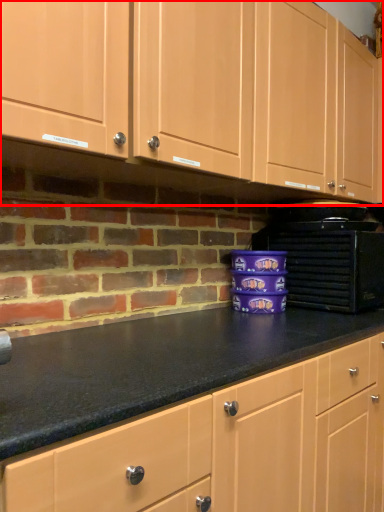
Question: In this image, where is cabinetry (annotated by the red box) located relative to home appliance?

Choices:
 (A) right
 (B) left

Answer: (B)